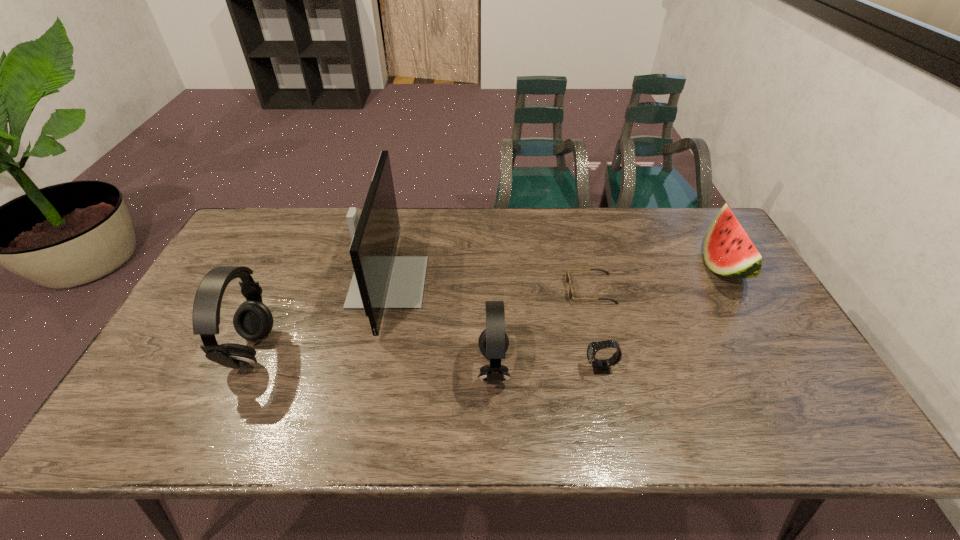
Find the location of `empty space that is in between the watch and the left earphone`. empty space that is in between the watch and the left earphone is located at coordinates (426, 359).

Locate an element on the screen. vacant area between the shortest object and the left earphone is located at coordinates (421, 319).

Where is `vacant space in between the rightmost object and the shorter earphone`? This screenshot has height=540, width=960. vacant space in between the rightmost object and the shorter earphone is located at coordinates (608, 316).

Where is `vacant region between the rightmost object and the fifth object from right to left`? The height and width of the screenshot is (540, 960). vacant region between the rightmost object and the fifth object from right to left is located at coordinates (555, 274).

Where is `vacant space that's between the shorter earphone and the second object from left to right`? This screenshot has height=540, width=960. vacant space that's between the shorter earphone and the second object from left to right is located at coordinates (441, 325).

The height and width of the screenshot is (540, 960). I want to click on object identified as the closest to the fifth shortest object, so click(x=381, y=280).

This screenshot has width=960, height=540. In order to click on object that stands as the fourth closest to the fifth object from right to left in this screenshot , I will do `click(599, 366)`.